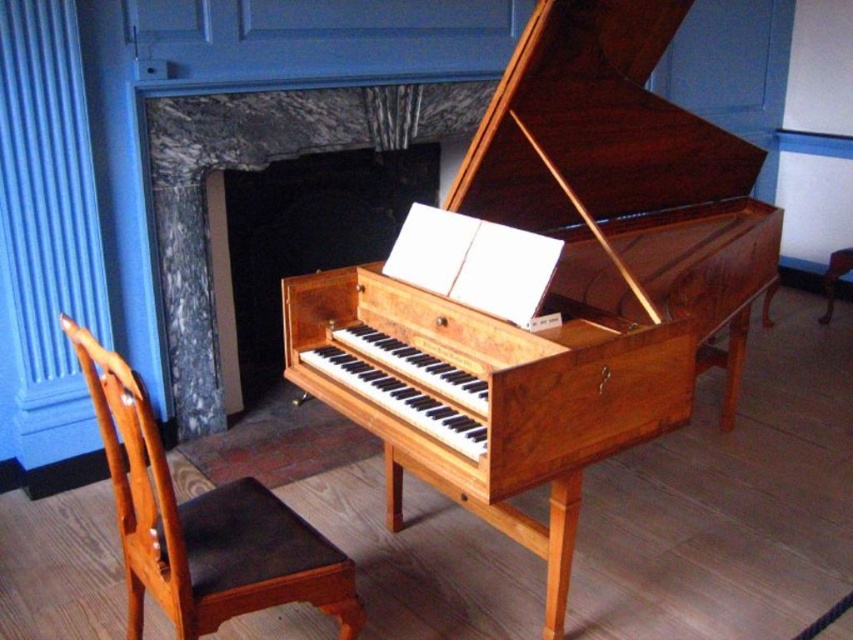
You are a stagehand setting up for a classical music performance. The stage requires that all seating must be placed at least 10 feet apart for safety. You have a mahogany wood chair at lower left and a brown wooden stool at lower right. Are these two items currently spaced appropriately according to the safety guidelines?

The mahogany wood chair at lower left is 12.20 feet from the brown wooden stool at lower right. Since the required distance is at least 10 feet, the current spacing meets the safety guidelines.